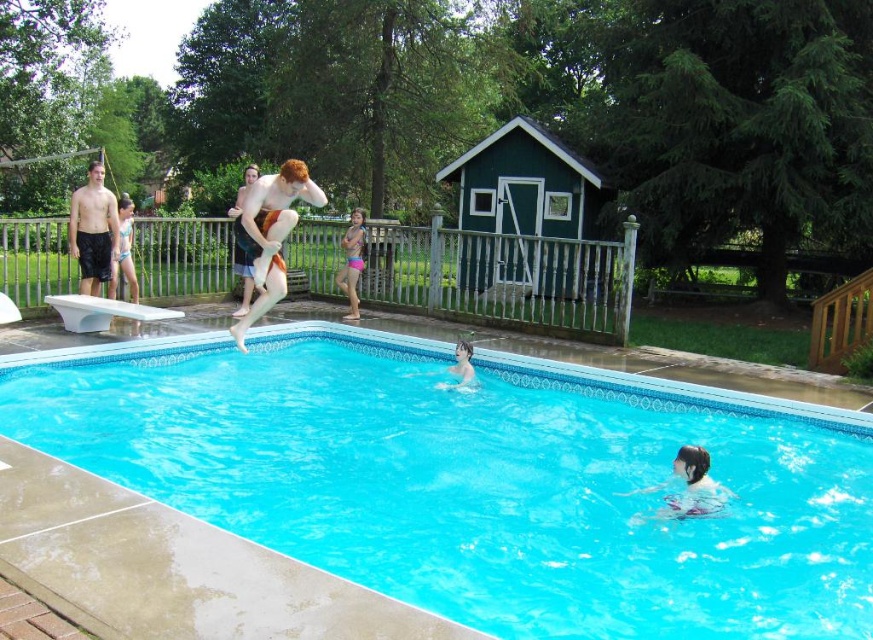
Does blue glossy water at center appear on the right side of smooth skin man at upper center?

Yes, blue glossy water at center is to the right of smooth skin man at upper center.

Who is more distant from viewer, (45,499) or (280,205)?

Point (280,205)

Find the location of a particular element. The image size is (873, 640). blue glossy water at center is located at coordinates (421, 496).

Which of these two, smooth skin man at upper center or smooth tan skin at upper center, stands taller?

Standing taller between the two is smooth tan skin at upper center.

Measure the distance from smooth skin man at upper center to smooth tan skin at upper center.

They are 4.14 meters apart.

Locate an element on the screen. The height and width of the screenshot is (640, 873). smooth skin man at upper center is located at coordinates (270, 234).

Who is higher up, blue glossy water at center or smooth tan skin at upper center?

smooth tan skin at upper center is higher up.

Between blue glossy water at center and smooth tan skin at upper center, which one appears on the right side from the viewer's perspective?

blue glossy water at center

What do you see at coordinates (421, 496) in the screenshot?
I see `blue glossy water at center` at bounding box center [421, 496].

The image size is (873, 640). In order to click on blue glossy water at center in this screenshot , I will do `click(421, 496)`.